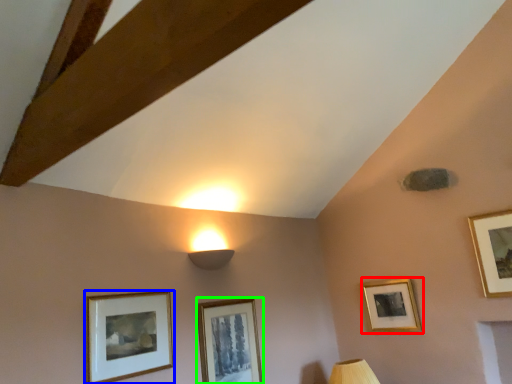
Question: Which object is the farthest from picture frame (highlighted by a red box)? Choose among these: picture frame (highlighted by a blue box) or picture frame (highlighted by a green box).

Choices:
 (A) picture frame
 (B) picture frame

Answer: (A)